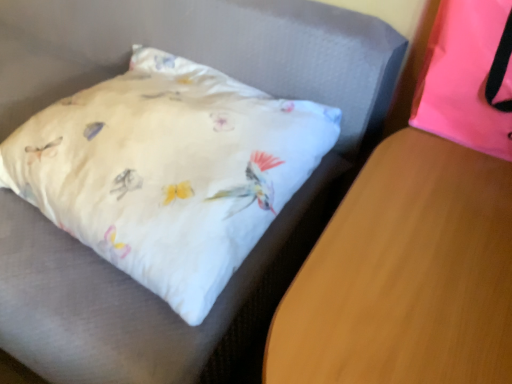
Question: Considering the relative positions of pink fabric pillow at upper right and wooden table at lower right in the image provided, is pink fabric pillow at upper right to the right of wooden table at lower right from the viewer's perspective?

Choices:
 (A) no
 (B) yes

Answer: (B)

Question: Does pink fabric pillow at upper right come behind wooden table at lower right?

Choices:
 (A) no
 (B) yes

Answer: (B)

Question: From the image's perspective, is pink fabric pillow at upper right over wooden table at lower right?

Choices:
 (A) no
 (B) yes

Answer: (B)

Question: Can you confirm if pink fabric pillow at upper right is wider than wooden table at lower right?

Choices:
 (A) yes
 (B) no

Answer: (B)

Question: From the image's perspective, does pink fabric pillow at upper right appear lower than wooden table at lower right?

Choices:
 (A) no
 (B) yes

Answer: (A)

Question: Is pink fabric pillow at upper right bigger than wooden table at lower right?

Choices:
 (A) no
 (B) yes

Answer: (A)

Question: Could you tell me if wooden table at lower right is turned towards pink fabric pillow at upper right?

Choices:
 (A) yes
 (B) no

Answer: (B)

Question: Is wooden table at lower right oriented away from pink fabric pillow at upper right?

Choices:
 (A) yes
 (B) no

Answer: (B)

Question: Is the depth of wooden table at lower right less than that of pink fabric pillow at upper right?

Choices:
 (A) no
 (B) yes

Answer: (B)

Question: Considering the relative sizes of wooden table at lower right and pink fabric pillow at upper right in the image provided, is wooden table at lower right bigger than pink fabric pillow at upper right?

Choices:
 (A) no
 (B) yes

Answer: (B)

Question: From the image's perspective, is wooden table at lower right above pink fabric pillow at upper right?

Choices:
 (A) yes
 (B) no

Answer: (B)

Question: Is wooden table at lower right to the left of pink fabric pillow at upper right from the viewer's perspective?

Choices:
 (A) yes
 (B) no

Answer: (A)

Question: From the image's perspective, relative to pink fabric pillow at upper right, is wooden table at lower right above or below?

Choices:
 (A) below
 (B) above

Answer: (A)